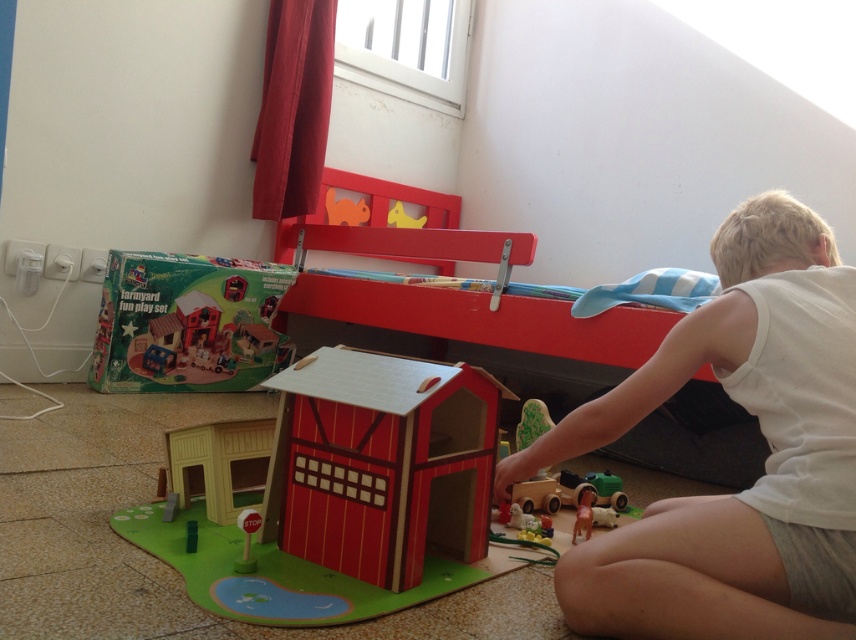
Does white cotton shirt at lower right come in front of matte cardboard farmyard fun play set at lower left?

Yes, it is in front of matte cardboard farmyard fun play set at lower left.

Can you confirm if white cotton shirt at lower right is positioned to the left of matte cardboard farmyard fun play set at lower left?

Incorrect, white cotton shirt at lower right is not on the left side of matte cardboard farmyard fun play set at lower left.

Identify the location of white cotton shirt at lower right. This screenshot has width=856, height=640. (765, 460).

Locate an element on the screen. white cotton shirt at lower right is located at coordinates (765, 460).

Is matte red bunk bed at upper center taller than matte cardboard farmyard fun play set at lower left?

Yes.

Looking at this image, how far apart are matte red bunk bed at upper center and matte cardboard farmyard fun play set at lower left?

matte red bunk bed at upper center and matte cardboard farmyard fun play set at lower left are 17.16 inches apart.

Does point (640, 353) come behind point (165, 376)?

No, (640, 353) is closer to viewer.

Locate an element on the screen. This screenshot has width=856, height=640. matte red bunk bed at upper center is located at coordinates (483, 320).

Based on the photo, does wooden barn at center have a greater height compared to matte red bunk bed at upper center?

Incorrect, wooden barn at center's height is not larger of matte red bunk bed at upper center's.

Can you confirm if wooden barn at center is wider than matte red bunk bed at upper center?

Incorrect, wooden barn at center's width does not surpass matte red bunk bed at upper center's.

Between point (423, 412) and point (364, 324), which one is positioned behind?

The point (364, 324) is more distant.

Where is `wooden barn at center`? wooden barn at center is located at coordinates (351, 497).